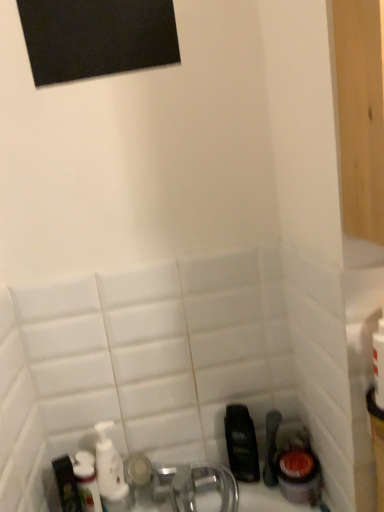
In order to face white glossy bottle at lower left, should I rotate leftwards or rightwards?

You should look left and rotate roughly 13.112 degrees.

The width and height of the screenshot is (384, 512). I want to click on dark brown plastic mouthwash at lower right, which is the first mouthwash from right to left, so click(x=241, y=443).

Where is `white glossy mouthwash at lower left, the 1th mouthwash when ordered from left to right`? Image resolution: width=384 pixels, height=512 pixels. white glossy mouthwash at lower left, the 1th mouthwash when ordered from left to right is located at coordinates (110, 472).

Where is `white glossy bottle at lower left`? The width and height of the screenshot is (384, 512). white glossy bottle at lower left is located at coordinates (87, 482).

Considering the sizes of objects dark brown plastic mouthwash at lower right, the second mouthwash positioned from the left, and white glossy mouthwash at lower left, the second mouthwash from the right, in the image provided, who is smaller, dark brown plastic mouthwash at lower right, the second mouthwash positioned from the left, or white glossy mouthwash at lower left, the second mouthwash from the right,?

dark brown plastic mouthwash at lower right, the second mouthwash positioned from the left, is smaller.

Is dark brown plastic mouthwash at lower right, which is the first mouthwash from right to left, turned away from white glossy mouthwash at lower left, the 1th mouthwash when ordered from left to right?

That's not correct — dark brown plastic mouthwash at lower right, which is the first mouthwash from right to left, is not looking away from white glossy mouthwash at lower left, the 1th mouthwash when ordered from left to right.

From the image's perspective, relative to white glossy mouthwash at lower left, the 1th mouthwash when ordered from left to right, is dark brown plastic mouthwash at lower right, the second mouthwash positioned from the left, above or below?

dark brown plastic mouthwash at lower right, the second mouthwash positioned from the left, is situated higher than white glossy mouthwash at lower left, the 1th mouthwash when ordered from left to right, in the image.

Does dark brown plastic mouthwash at lower right, which is the first mouthwash from right to left, touch white glossy mouthwash at lower left, the second mouthwash from the right?

No, dark brown plastic mouthwash at lower right, which is the first mouthwash from right to left, is not in contact with white glossy mouthwash at lower left, the second mouthwash from the right.

Between white glossy mouthwash at lower left, the second mouthwash from the right, and dark brown plastic mouthwash at lower right, the second mouthwash positioned from the left, which one appears on the right side from the viewer's perspective?

Positioned to the right is dark brown plastic mouthwash at lower right, the second mouthwash positioned from the left.

Would you say white glossy mouthwash at lower left, the 1th mouthwash when ordered from left to right, is inside or outside dark brown plastic mouthwash at lower right, the second mouthwash positioned from the left?

white glossy mouthwash at lower left, the 1th mouthwash when ordered from left to right, lies outside dark brown plastic mouthwash at lower right, the second mouthwash positioned from the left.

Considering the relative sizes of white glossy mouthwash at lower left, the 1th mouthwash when ordered from left to right, and dark brown plastic mouthwash at lower right, which is the first mouthwash from right to left, in the image provided, is white glossy mouthwash at lower left, the 1th mouthwash when ordered from left to right, thinner than dark brown plastic mouthwash at lower right, which is the first mouthwash from right to left,?

In fact, white glossy mouthwash at lower left, the 1th mouthwash when ordered from left to right, might be wider than dark brown plastic mouthwash at lower right, which is the first mouthwash from right to left.

In the scene shown: Considering the relative sizes of white glossy mouthwash at lower left, the 1th mouthwash when ordered from left to right, and dark brown plastic mouthwash at lower right, the second mouthwash positioned from the left, in the image provided, is white glossy mouthwash at lower left, the 1th mouthwash when ordered from left to right, shorter than dark brown plastic mouthwash at lower right, the second mouthwash positioned from the left,?

No.

Does white glossy mouthwash at lower left, the 1th mouthwash when ordered from left to right, appear on the left side of white glossy bottle at lower left?

In fact, white glossy mouthwash at lower left, the 1th mouthwash when ordered from left to right, is to the right of white glossy bottle at lower left.

How much distance is there between white glossy mouthwash at lower left, the 1th mouthwash when ordered from left to right, and white glossy bottle at lower left?

1.46 inches.

Which of these two, white glossy mouthwash at lower left, the second mouthwash from the right, or white glossy bottle at lower left, is bigger?

white glossy mouthwash at lower left, the second mouthwash from the right, is bigger.

From a real-world perspective, which is physically above, white glossy mouthwash at lower left, the second mouthwash from the right, or white glossy bottle at lower left?

white glossy bottle at lower left, from a real-world perspective.

Could you tell me if dark brown plastic mouthwash at lower right, the second mouthwash positioned from the left, is turned towards white glossy bottle at lower left?

No, dark brown plastic mouthwash at lower right, the second mouthwash positioned from the left, is not oriented towards white glossy bottle at lower left.

Is dark brown plastic mouthwash at lower right, the second mouthwash positioned from the left, taller than white glossy bottle at lower left?

Incorrect, the height of dark brown plastic mouthwash at lower right, the second mouthwash positioned from the left, is not larger of that of white glossy bottle at lower left.

From the image's perspective, does dark brown plastic mouthwash at lower right, the second mouthwash positioned from the left, appear lower than white glossy bottle at lower left?

Incorrect, from the image's perspective, dark brown plastic mouthwash at lower right, the second mouthwash positioned from the left, is higher than white glossy bottle at lower left.

From a real-world perspective, is dark brown plastic mouthwash at lower right, the second mouthwash positioned from the left, physically below white glossy bottle at lower left?

Indeed, from a real-world perspective, dark brown plastic mouthwash at lower right, the second mouthwash positioned from the left, is positioned beneath white glossy bottle at lower left.

Starting from the white glossy bottle at lower left, which mouthwash is the 1st one behind? Please provide its 2D coordinates.

[(110, 472)]

Does white glossy bottle at lower left have a greater width compared to white glossy mouthwash at lower left, the second mouthwash from the right?

No, white glossy bottle at lower left is not wider than white glossy mouthwash at lower left, the second mouthwash from the right.

Between white glossy bottle at lower left and white glossy mouthwash at lower left, the second mouthwash from the right, which one has more height?

Standing taller between the two is white glossy mouthwash at lower left, the second mouthwash from the right.

Considering their positions, is white glossy bottle at lower left located in front of or behind dark brown plastic mouthwash at lower right, the second mouthwash positioned from the left?

Clearly, white glossy bottle at lower left is in front of dark brown plastic mouthwash at lower right, the second mouthwash positioned from the left.

Can you confirm if white glossy bottle at lower left is positioned to the left of dark brown plastic mouthwash at lower right, the second mouthwash positioned from the left?

Yes, white glossy bottle at lower left is to the left of dark brown plastic mouthwash at lower right, the second mouthwash positioned from the left.

In the scene shown: From the image's perspective, who appears lower, white glossy bottle at lower left or dark brown plastic mouthwash at lower right, the second mouthwash positioned from the left?

From the image's view, white glossy bottle at lower left is below.

Is white glossy bottle at lower left wider or thinner than dark brown plastic mouthwash at lower right, which is the first mouthwash from right to left?

Clearly, white glossy bottle at lower left has more width compared to dark brown plastic mouthwash at lower right, which is the first mouthwash from right to left.

Find the location of a particular element. The image size is (384, 512). mouthwash on the left of dark brown plastic mouthwash at lower right, the second mouthwash positioned from the left is located at coordinates (110, 472).

There is a dark brown plastic mouthwash at lower right, the second mouthwash positioned from the left. What are the coordinates of `mouthwash above it (from a real-world perspective)` in the screenshot? It's located at (110, 472).

Based on their spatial positions, is white glossy bottle at lower left or dark brown plastic mouthwash at lower right, the second mouthwash positioned from the left, closer to white glossy mouthwash at lower left, the second mouthwash from the right?

white glossy bottle at lower left.

Which object lies nearer to the anchor point white glossy mouthwash at lower left, the second mouthwash from the right, dark brown plastic mouthwash at lower right, which is the first mouthwash from right to left, or white glossy bottle at lower left?

Based on the image, white glossy bottle at lower left appears to be nearer to white glossy mouthwash at lower left, the second mouthwash from the right.

Estimate the real-world distances between objects in this image. Which object is closer to white glossy bottle at lower left, white glossy mouthwash at lower left, the 1th mouthwash when ordered from left to right, or dark brown plastic mouthwash at lower right, which is the first mouthwash from right to left?

The object closer to white glossy bottle at lower left is white glossy mouthwash at lower left, the 1th mouthwash when ordered from left to right.

Based on their spatial positions, is white glossy mouthwash at lower left, the second mouthwash from the right, or white glossy bottle at lower left further from dark brown plastic mouthwash at lower right, which is the first mouthwash from right to left?

Among the two, white glossy bottle at lower left is located further to dark brown plastic mouthwash at lower right, which is the first mouthwash from right to left.

Looking at the image, which one is located further to dark brown plastic mouthwash at lower right, which is the first mouthwash from right to left, white glossy bottle at lower left or white glossy mouthwash at lower left, the second mouthwash from the right?

white glossy bottle at lower left is positioned further to the anchor dark brown plastic mouthwash at lower right, which is the first mouthwash from right to left.

From the image, which object appears to be nearer to white glossy bottle at lower left, dark brown plastic mouthwash at lower right, the second mouthwash positioned from the left, or white glossy mouthwash at lower left, the 1th mouthwash when ordered from left to right?

white glossy mouthwash at lower left, the 1th mouthwash when ordered from left to right, lies closer to white glossy bottle at lower left than the other object.

Identify the location of mouthwash between white glossy bottle at lower left and dark brown plastic mouthwash at lower right, which is the first mouthwash from right to left, from left to right. Image resolution: width=384 pixels, height=512 pixels. (110, 472).